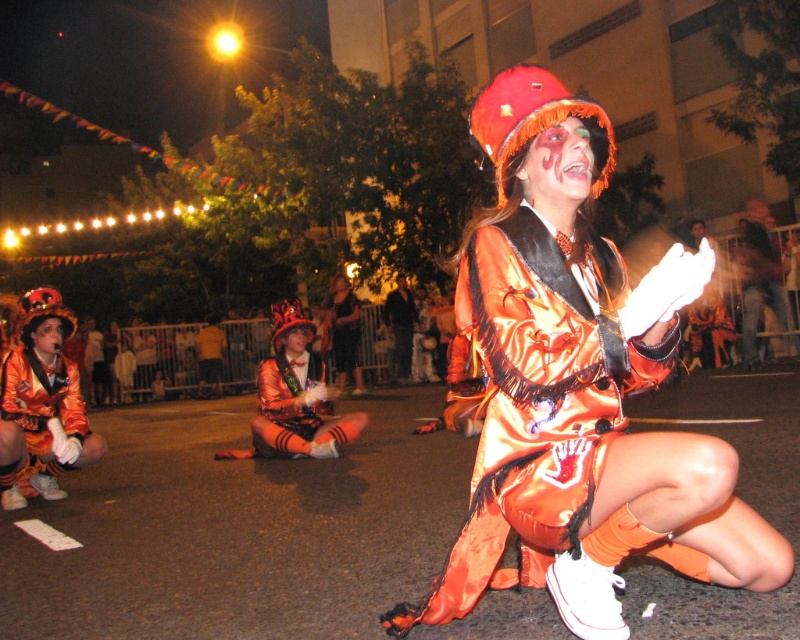
You are a costume designer observing the image. You need to identify where the point at coordinates [296,410] falls on the costume. Which part of the costume does this point correspond to?

The point at coordinates [296,410] is located on the satin velvet shorts at center.